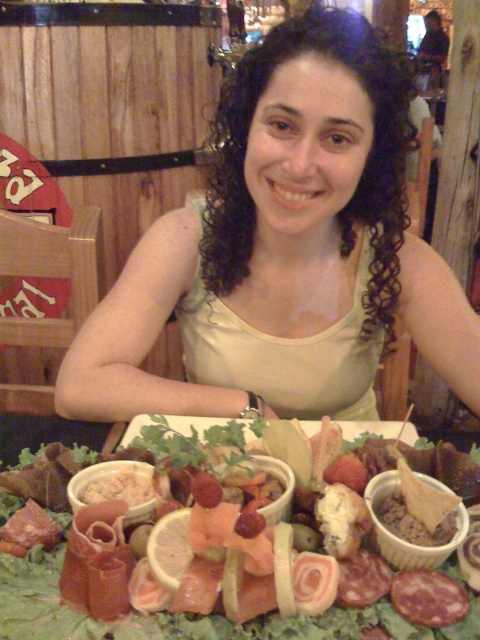
Question: Among these points, which one is nearest to the camera?

Choices:
 (A) (324, 614)
 (B) (335, 268)

Answer: (A)

Question: Which object is farther from the camera taking this photo?

Choices:
 (A) matte white cheese at center
 (B) green fabric tank top at center

Answer: (B)

Question: Which of the following is the closest to the observer?

Choices:
 (A) (224, 166)
 (B) (107, 628)

Answer: (B)

Question: Can you confirm if green fabric tank top at center is positioned below matte white cheese at center?

Choices:
 (A) yes
 (B) no

Answer: (B)

Question: Can you confirm if green fabric tank top at center is positioned below matte white cheese at center?

Choices:
 (A) yes
 (B) no

Answer: (B)

Question: Is green fabric tank top at center below matte white cheese at center?

Choices:
 (A) no
 (B) yes

Answer: (A)